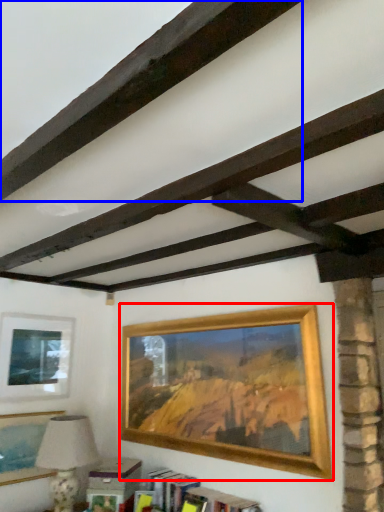
Question: Which point is closer to the camera, picture frame (highlighted by a red box) or plank (highlighted by a blue box)?

Choices:
 (A) picture frame
 (B) plank

Answer: (B)